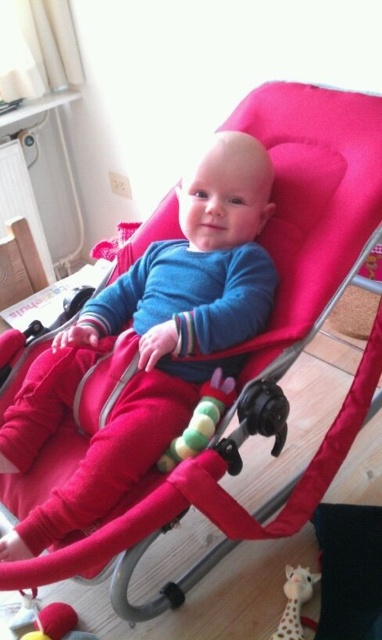
From the picture: Which of these two, soft plush giraffe at lower center or soft plush toy at lower left, stands taller?

soft plush giraffe at lower center is taller.

Does soft plush giraffe at lower center appear on the right side of soft plush toy at lower left?

Indeed, soft plush giraffe at lower center is positioned on the right side of soft plush toy at lower left.

Is point (288, 586) in front of point (30, 632)?

That is False.

This screenshot has height=640, width=382. What are the coordinates of `soft plush giraffe at lower center` in the screenshot? It's located at (294, 602).